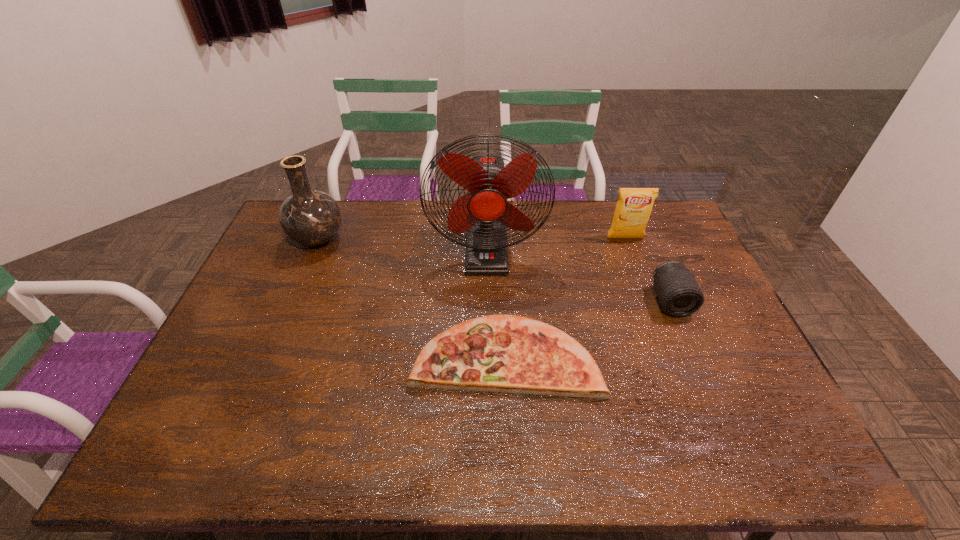
The height and width of the screenshot is (540, 960). In the image, there is a desktop. Identify the location of vacant space at the left edge. (260, 292).

Where is `free space between the tallest object and the vase`? free space between the tallest object and the vase is located at coordinates (402, 245).

Locate an element on the screen. vacant space in between the fan and the vase is located at coordinates (402, 245).

Where is `free space between the shortest object and the leftmost object`? free space between the shortest object and the leftmost object is located at coordinates (411, 298).

Find the location of `free spot between the crisp (potato chip) and the pizza`. free spot between the crisp (potato chip) and the pizza is located at coordinates (565, 297).

You are a GUI agent. You are given a task and a screenshot of the screen. Output one action in this format:
    pyautogui.click(x=<x>, y=<y>)
    Task: Click on the free point between the telephoto lens and the tallest object
    
    Given the screenshot: What is the action you would take?
    pyautogui.click(x=579, y=276)

This screenshot has height=540, width=960. Identify the location of free space between the tallest object and the second shortest object. (579, 276).

This screenshot has height=540, width=960. I want to click on free area in between the tallest object and the shortest object, so click(x=495, y=303).

The height and width of the screenshot is (540, 960). I want to click on vacant area between the tallest object and the second tallest object, so click(x=402, y=245).

This screenshot has height=540, width=960. I want to click on object that stands as the closest to the pizza, so click(x=484, y=213).